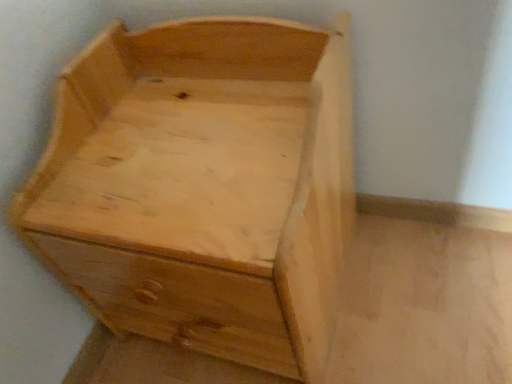
Describe the element at coordinates (202, 186) in the screenshot. I see `natural wood chest of drawers at center` at that location.

Where is `natural wood chest of drawers at center`? natural wood chest of drawers at center is located at coordinates (202, 186).

What are the coordinates of `natural wood chest of drawers at center` in the screenshot? It's located at (202, 186).